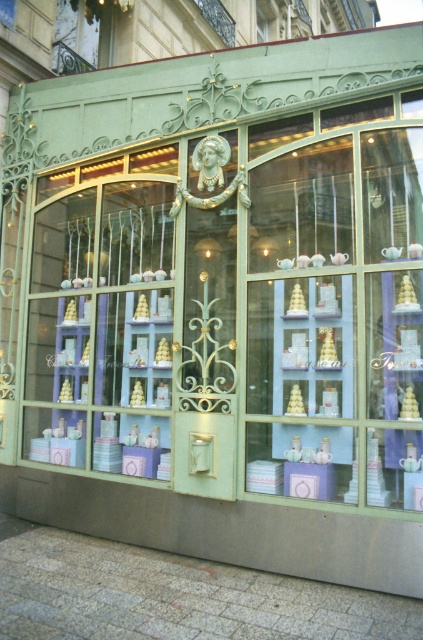
Is matte glass door at center shorter than metallic wrought iron at upper left?

Incorrect, matte glass door at center's height does not fall short of metallic wrought iron at upper left's.

Between matte glass door at center and metallic wrought iron at upper left, which one appears on the right side from the viewer's perspective?

matte glass door at center is more to the right.

Is point (373, 496) more distant than point (80, 13)?

No, it is not.

This screenshot has width=423, height=640. Identify the location of matte glass door at center. (337, 320).